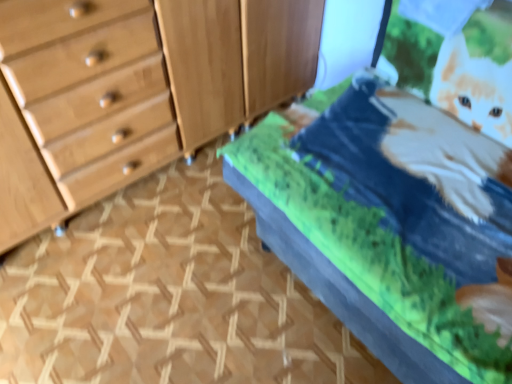
Question: In terms of size, does velvet green bed at center appear bigger or smaller than light brown wood dresser at left?

Choices:
 (A) small
 (B) big

Answer: (B)

Question: From the image's perspective, is velvet green bed at center positioned above or below light brown wood dresser at left?

Choices:
 (A) above
 (B) below

Answer: (B)

Question: Considering the real-world distances, which object is farthest from the wooden cabinet at center?

Choices:
 (A) velvet green bed at center
 (B) light brown wood dresser at left

Answer: (A)

Question: Which object is positioned closest to the wooden cabinet at center?

Choices:
 (A) velvet green bed at center
 (B) light brown wood dresser at left

Answer: (B)